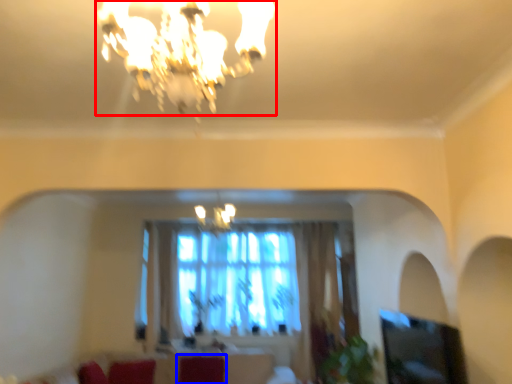
Question: Which of the following is the closest to the observer, lamp (highlighted by a red box) or swivel chair (highlighted by a blue box)?

Choices:
 (A) lamp
 (B) swivel chair

Answer: (A)